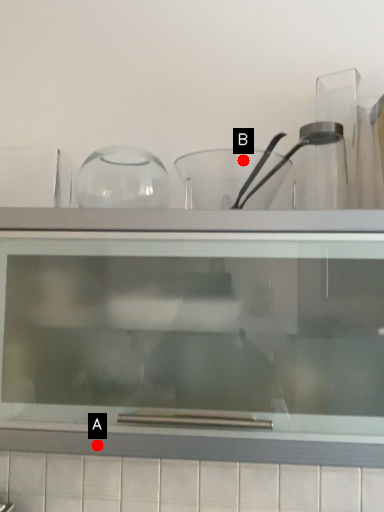
Question: Two points are circled on the image, labeled by A and B beside each circle. Which point is closer to the camera?

Choices:
 (A) A is closer
 (B) B is closer

Answer: (A)